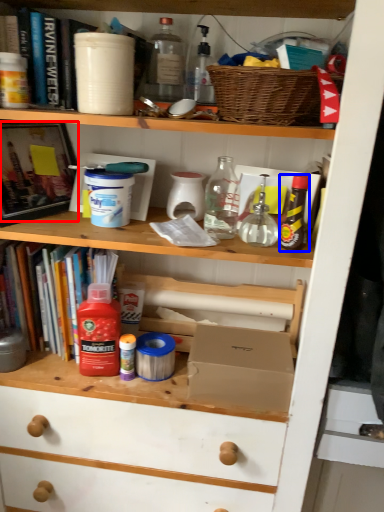
Question: Among these objects, which one is farthest to the camera, book (highlighted by a red box) or bottle (highlighted by a blue box)?

Choices:
 (A) book
 (B) bottle

Answer: (A)